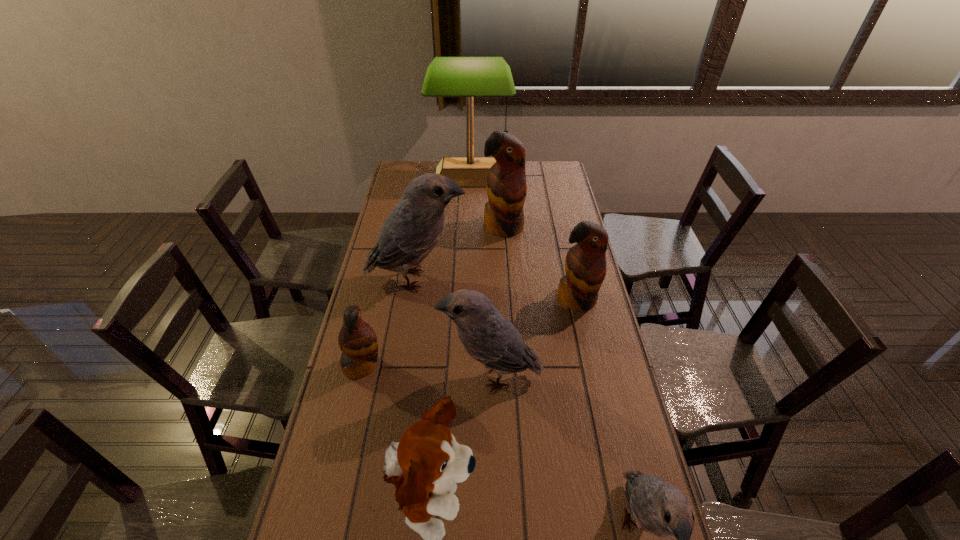
Locate which object ranks in proximity to the second biggest gray parrot. Please provide its 2D coordinates. Your answer should be formatted as a tuple, i.e. [(x, y)], where the tuple contains the x and y coordinates of a point satisfying the conditions above.

[(358, 342)]

Select which parrot appears as the fourth closest to the farthest parrot. Please provide its 2D coordinates. Your answer should be formatted as a tuple, i.e. [(x, y)], where the tuple contains the x and y coordinates of a point satisfying the conditions above.

[(358, 342)]

Identify which parrot is the second closest to the brown puppy. Please provide its 2D coordinates. Your answer should be formatted as a tuple, i.e. [(x, y)], where the tuple contains the x and y coordinates of a point satisfying the conditions above.

[(358, 342)]

Where is `gray parrot that stands as the second closest to the brown puppy`? gray parrot that stands as the second closest to the brown puppy is located at coordinates (662, 509).

Locate an element on the screen. the second closest gray parrot to the smallest gray parrot is located at coordinates (411, 231).

Identify the location of red parrot that is the closest to the nearest parrot. (585, 264).

Choose which red parrot is the third nearest neighbor to the second smallest gray parrot. Please provide its 2D coordinates. Your answer should be formatted as a tuple, i.e. [(x, y)], where the tuple contains the x and y coordinates of a point satisfying the conditions above.

[(506, 183)]

Find the location of a particular element. This screenshot has width=960, height=540. free space that satisfies the following two spatial constraints: 1. on the face of the farthest red parrot; 2. on the front-facing side of the biggest gray parrot is located at coordinates (507, 280).

Identify the location of vacant space that satisfies the following two spatial constraints: 1. on the metallic stand of the farthest object; 2. on the front-facing side of the biggest gray parrot. (468, 280).